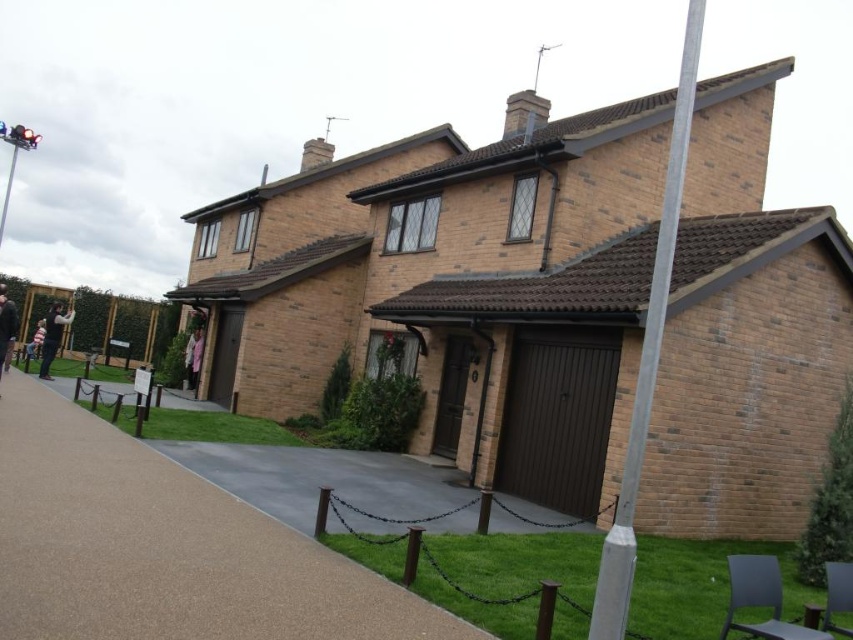
Can you confirm if brown asphalt pavement at center is thinner than silver metallic pole at upper right?

No.

What are the coordinates of `brown asphalt pavement at center` in the screenshot? It's located at (165, 547).

Does point (312, 604) come farther from viewer compared to point (608, 618)?

Yes, it is behind point (608, 618).

At what (x,y) coordinates should I click in order to perform the action: click on brown asphalt pavement at center. Please return your answer as a coordinate pair (x, y). This screenshot has height=640, width=853. Looking at the image, I should click on (165, 547).